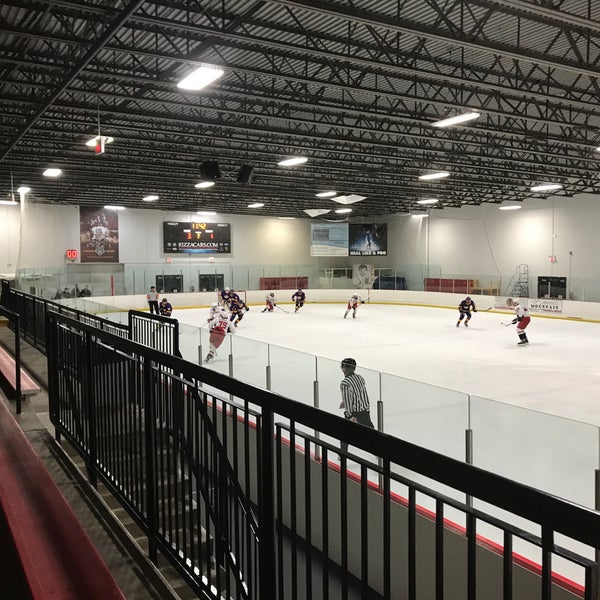
Where is `stairs`? The width and height of the screenshot is (600, 600). stairs is located at coordinates (118, 508).